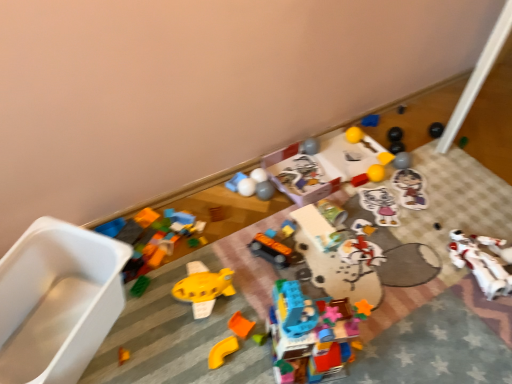
Find the location of a particular element. The width and height of the screenshot is (512, 384). free space between yellow rubber ball at upper center, acting as the fifteenth toy starting from the left, and yellow matte toy boat at center, which ranks as the 16th toy in right-to-left order is located at coordinates (288, 232).